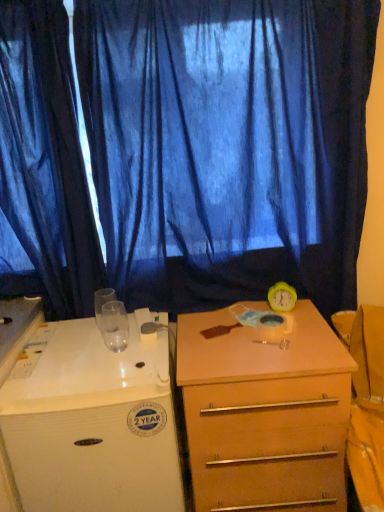
Question: Does white glossy desk at left appear on the left side of light brown wood drawer at center?

Choices:
 (A) no
 (B) yes

Answer: (B)

Question: From a real-world perspective, does white glossy desk at left sit lower than light brown wood drawer at center?

Choices:
 (A) yes
 (B) no

Answer: (B)

Question: Is white glossy desk at left looking in the opposite direction of light brown wood drawer at center?

Choices:
 (A) no
 (B) yes

Answer: (A)

Question: Is white glossy desk at left touching light brown wood drawer at center?

Choices:
 (A) no
 (B) yes

Answer: (A)

Question: Is white glossy desk at left positioned behind light brown wood drawer at center?

Choices:
 (A) yes
 (B) no

Answer: (B)

Question: In terms of size, does blue sheer curtain at upper center, which is the second curtain in left-to-right order, appear bigger or smaller than white glossy desk at left?

Choices:
 (A) small
 (B) big

Answer: (A)

Question: Visually, is blue sheer curtain at upper center, the first curtain in the right-to-left sequence, positioned to the left or to the right of white glossy desk at left?

Choices:
 (A) right
 (B) left

Answer: (A)

Question: From a real-world perspective, relative to white glossy desk at left, is blue sheer curtain at upper center, which is the second curtain in left-to-right order, vertically above or below?

Choices:
 (A) above
 (B) below

Answer: (A)

Question: Does point (49, 128) appear closer or farther from the camera than point (54, 460)?

Choices:
 (A) closer
 (B) farther

Answer: (B)

Question: From a real-world perspective, is white glossy desk at left physically located above or below blue sheer curtain at left, which is counted as the first curtain, starting from the left?

Choices:
 (A) above
 (B) below

Answer: (B)

Question: Is point (125, 437) closer or farther from the camera than point (61, 267)?

Choices:
 (A) farther
 (B) closer

Answer: (B)

Question: Considering their positions, is white glossy desk at left located in front of or behind blue sheer curtain at left, which appears as the second curtain when viewed from the right?

Choices:
 (A) front
 (B) behind

Answer: (A)

Question: Would you say white glossy desk at left is to the left or to the right of blue sheer curtain at left, which appears as the second curtain when viewed from the right, in the picture?

Choices:
 (A) left
 (B) right

Answer: (B)

Question: In the image, is blue sheer curtain at left, which appears as the second curtain when viewed from the right, positioned in front of or behind light brown wood drawer at center?

Choices:
 (A) front
 (B) behind

Answer: (B)

Question: From the image's perspective, is blue sheer curtain at left, which appears as the second curtain when viewed from the right, located above or below light brown wood drawer at center?

Choices:
 (A) below
 (B) above

Answer: (B)